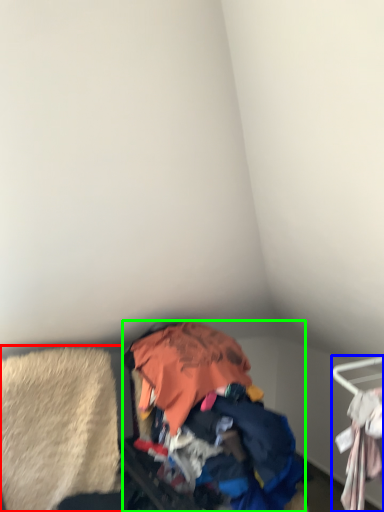
Question: Which is farther away from clothing (highlighted by a red box)? furniture (highlighted by a blue box) or garbage (highlighted by a green box)?

Choices:
 (A) furniture
 (B) garbage

Answer: (A)